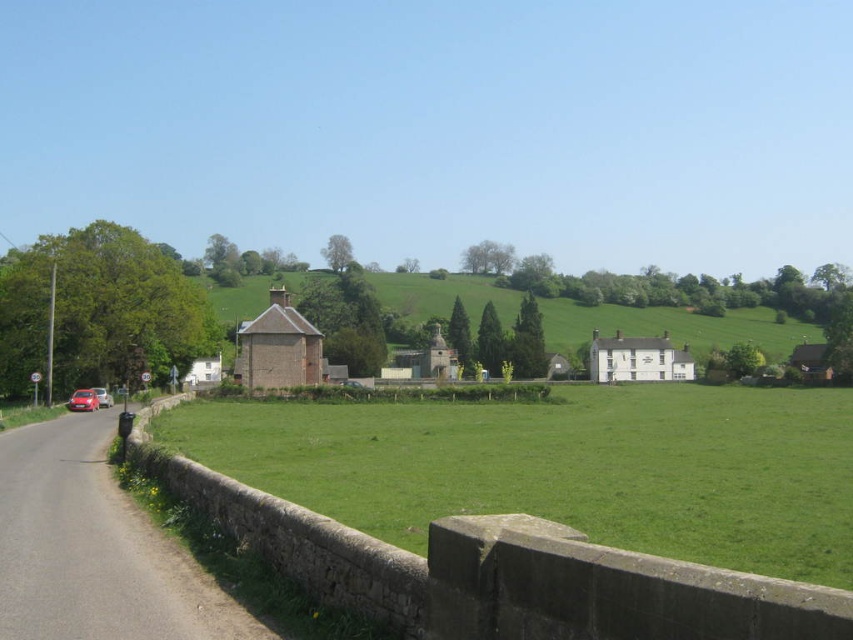
You are standing at the bottom left corner of the image. You want to walk directly towards the green grass field at center. In which direction should you head?

Since the green grass field at center is located at point [563,467], you should head towards the center of the image from the bottom left corner.